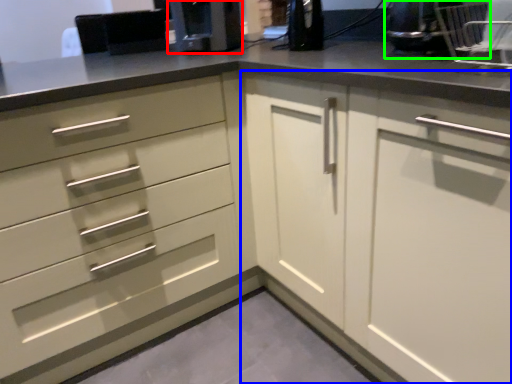
Question: Which object is positioned closest to coffee machine (highlighted by a red box)? Select from cabinetry (highlighted by a blue box) and appliance (highlighted by a green box).

Choices:
 (A) cabinetry
 (B) appliance

Answer: (A)